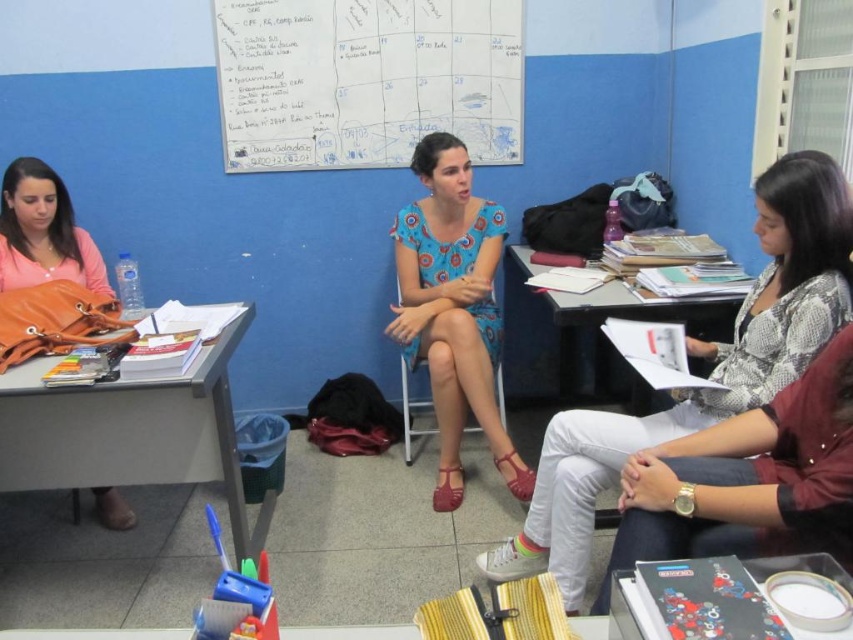
Is blue floral dress at center shorter than orange fabric table at left?

No.

Can you confirm if blue floral dress at center is positioned above orange fabric table at left?

Yes.

Does point (782, 189) come closer to viewer compared to point (47, 404)?

Yes, it is.

What are the coordinates of `blue floral dress at center` in the screenshot? It's located at (709, 372).

Does point (177, 413) come farther from viewer compared to point (514, 253)?

No, (177, 413) is in front of (514, 253).

Is orange fabric table at left wider than white paper at center?

Yes, orange fabric table at left is wider than white paper at center.

Is point (161, 397) less distant than point (624, 317)?

Yes, it is in front of point (624, 317).

Where is `orange fabric table at left`? orange fabric table at left is located at coordinates (131, 433).

Is blue printed dress at center closer to camera compared to matte orange purse at left?

No.

Is point (440, 230) positioned behind point (36, 250)?

Yes, it is.

Find the location of a particular element. blue printed dress at center is located at coordinates (453, 308).